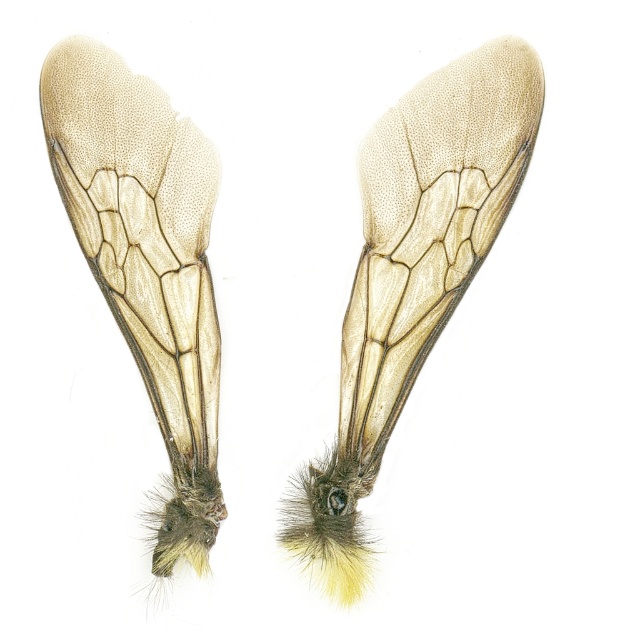
Does translucent beige wings at center appear on the right side of translucent beige wing at center?

Correct, you'll find translucent beige wings at center to the right of translucent beige wing at center.

Does translucent beige wings at center have a smaller size compared to translucent beige wing at center?

No, translucent beige wings at center is not smaller than translucent beige wing at center.

Locate an element on the screen. translucent beige wings at center is located at coordinates (412, 275).